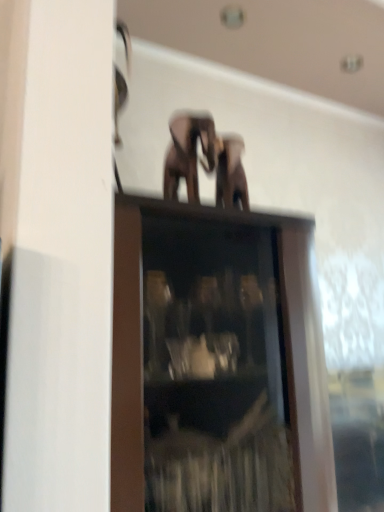
Locate an element on the screen. This screenshot has height=512, width=384. brown wooden elephant at center is located at coordinates (188, 152).

What is the approximate height of brown wooden elephant at center?

The height of brown wooden elephant at center is 22.25 centimeters.

Describe the element at coordinates (188, 152) in the screenshot. I see `brown wooden elephant at center` at that location.

At what (x,y) coordinates should I click in order to perform the action: click on brown wooden elephant at center. Please return your answer as a coordinate pair (x, y). Image resolution: width=384 pixels, height=512 pixels. Looking at the image, I should click on (188, 152).